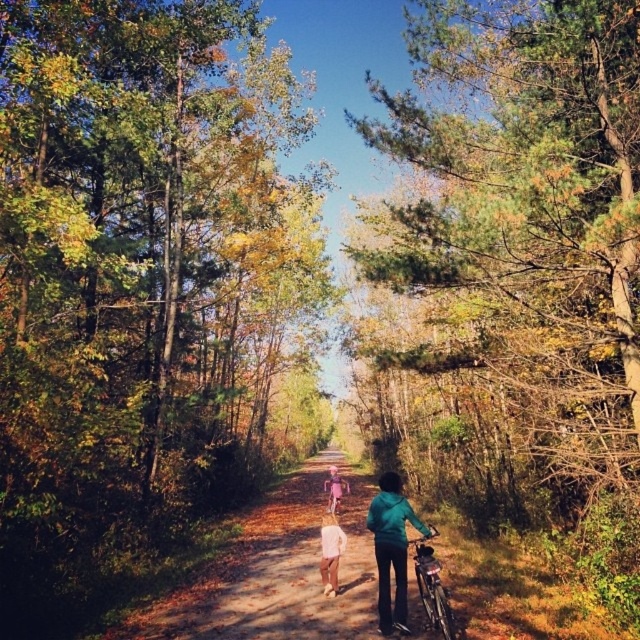
You are a hiker planning to walk along the brown dirt path at center while avoiding stepping on the white cotton shirt at center. Given their sizes, which one is wider?

The brown dirt path at center is wider than the white cotton shirt at center, so the path is wider.

You are a hiker trying to decide whether your pink fabric dress at center can fit on the brown dirt path at center without touching the trees on either side. Based on the scene, can you determine if the dress will fit comfortably?

The brown dirt path at center is wider than the pink fabric dress at center, so the dress should fit comfortably without touching the trees on either side.